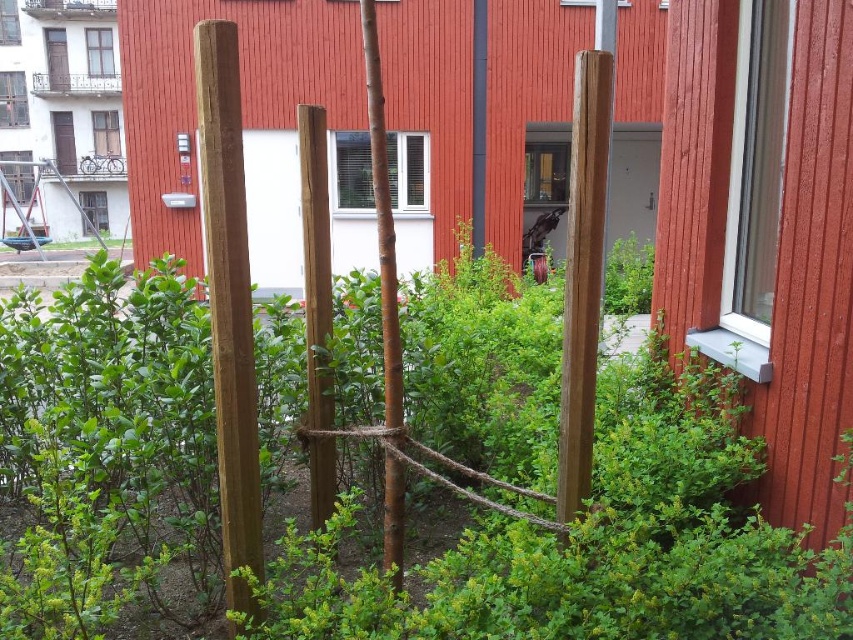
You are standing at the center of the garden and want to place a new plant exactly where the natural wood pole at center is located. Is this possible?

The natural wood pole at center is already located at point (229, 304), so you cannot place a new plant there as the pole is already occupying that spot.

You are standing in the garden area and want to take a photo that includes both the point at coordinates (210, 20) and the point at (583, 209). Which point should you focus on first to ensure both are in sharp focus?

You should focus on the point at coordinates (210, 20) first because it is closer to the camera than the point at (583, 209). This ensures the closer point is in focus, and the farther point will also be within the depth of field.

You are trying to decide which pole to use for hanging a large bird feeder. The natural wood pole at center and the smooth brown pole at center are both available. Which pole can support the bird feeder better based on their sizes?

The natural wood pole at center is bigger than the smooth brown pole at center, so it can support the bird feeder better due to its larger size.